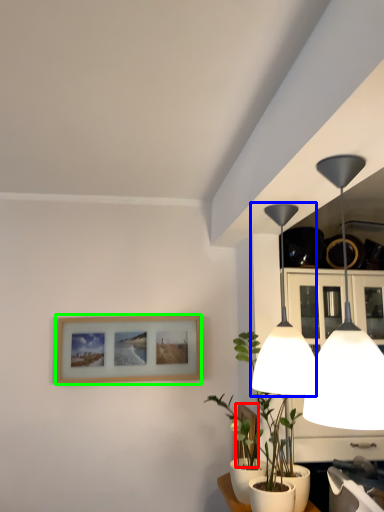
Question: Considering the real-world distances, which object is closest to picture frame (highlighted by a red box)? lamp (highlighted by a blue box) or picture frame (highlighted by a green box).

Choices:
 (A) lamp
 (B) picture frame

Answer: (B)